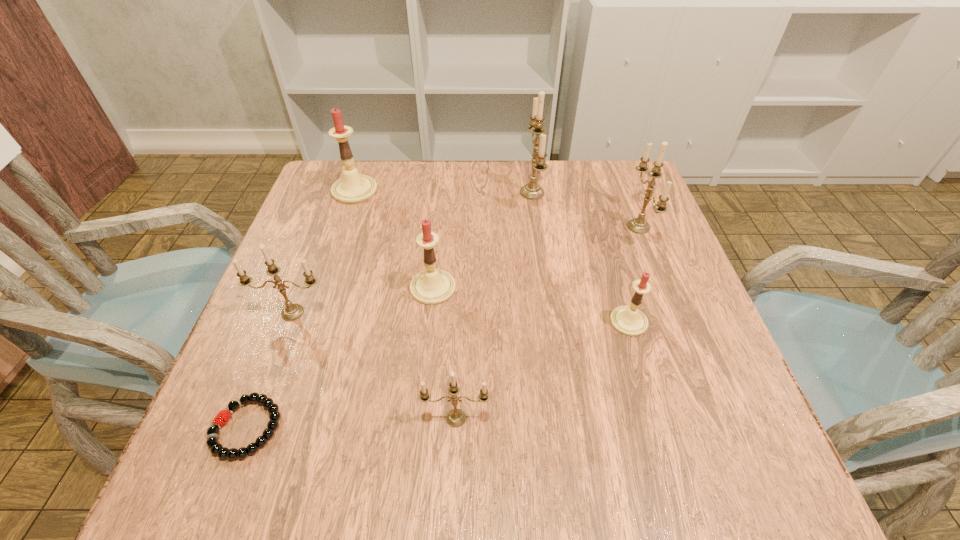
Locate an element on the screen. The image size is (960, 540). vacant area at the near edge is located at coordinates (549, 471).

In the image, there is a desktop. Identify the location of vacant space at the left edge. The height and width of the screenshot is (540, 960). (288, 266).

The width and height of the screenshot is (960, 540). Find the location of `vacant space at the right edge`. vacant space at the right edge is located at coordinates (681, 414).

Locate an element on the screen. This screenshot has width=960, height=540. free space at the far right corner of the desktop is located at coordinates (634, 177).

Where is `empty space that is in between the second metallic candle from left to right and the rightmost red candle`? Image resolution: width=960 pixels, height=540 pixels. empty space that is in between the second metallic candle from left to right and the rightmost red candle is located at coordinates (542, 370).

The width and height of the screenshot is (960, 540). Identify the location of blank region between the nearest candle and the rightmost candle. (547, 322).

Where is `free space between the tallest object and the rightmost candle`? free space between the tallest object and the rightmost candle is located at coordinates (586, 210).

This screenshot has width=960, height=540. What are the coordinates of `blank region between the second smallest metallic candle and the fifth candle from left to right` in the screenshot? It's located at (413, 253).

The height and width of the screenshot is (540, 960). In order to click on vacant space that's between the second object from right to left and the sixth object from left to right in this screenshot , I will do `click(581, 257)`.

Locate an element on the screen. empty space between the rightmost object and the second metallic candle from left to right is located at coordinates (547, 322).